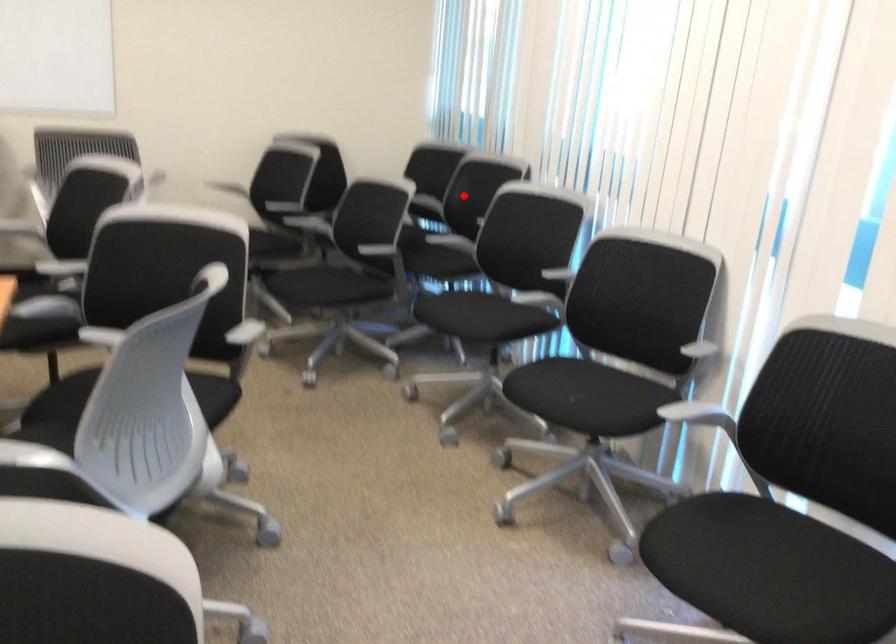
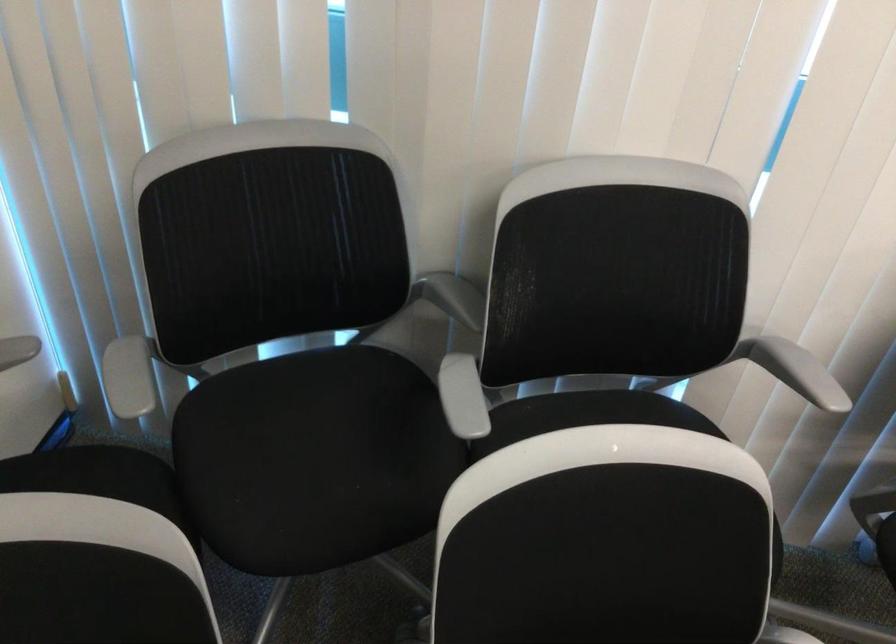
Question: I am providing you with two images of the same scene from different viewpoints. In image1, a red point is highlighted. Considering the same 3D point in image2, which of the following is correct?

Choices:
 (A) It is closer
 (B) It is farther

Answer: (A)